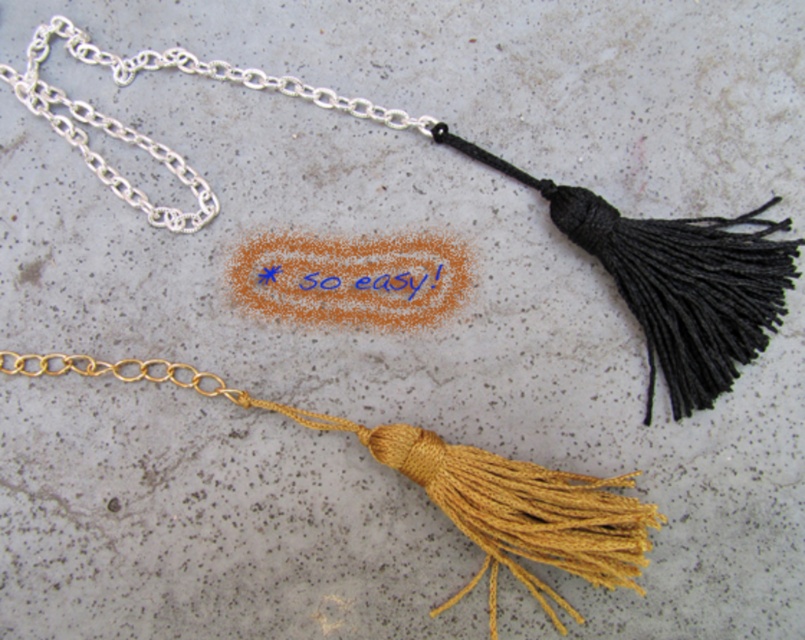
Is satin gold tassel at lower center positioned before silver chain at upper left?

That is True.

Who is more forward, (558, 554) or (246, 70)?

Point (558, 554) is more forward.

Does point (547, 538) come farther from viewer compared to point (378, 106)?

That is False.

Where is `satin gold tassel at lower center`? This screenshot has width=805, height=640. satin gold tassel at lower center is located at coordinates (453, 488).

Who is higher up, satin gold tassel at lower center or blue ink writing at center?

blue ink writing at center is above.

Which is below, satin gold tassel at lower center or blue ink writing at center?

satin gold tassel at lower center

Where is `satin gold tassel at lower center`? The width and height of the screenshot is (805, 640). satin gold tassel at lower center is located at coordinates (453, 488).

Can you confirm if silver chain at upper left is smaller than blue ink writing at center?

Incorrect, silver chain at upper left is not smaller in size than blue ink writing at center.

Between point (100, 163) and point (422, 278), which one is positioned in front?

Point (100, 163)

This screenshot has height=640, width=805. Identify the location of silver chain at upper left. (149, 138).